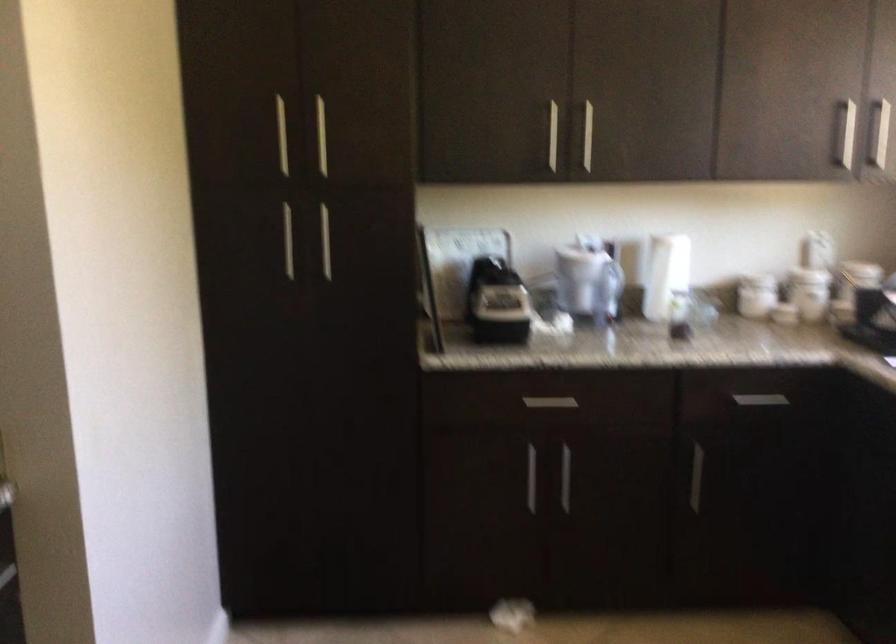
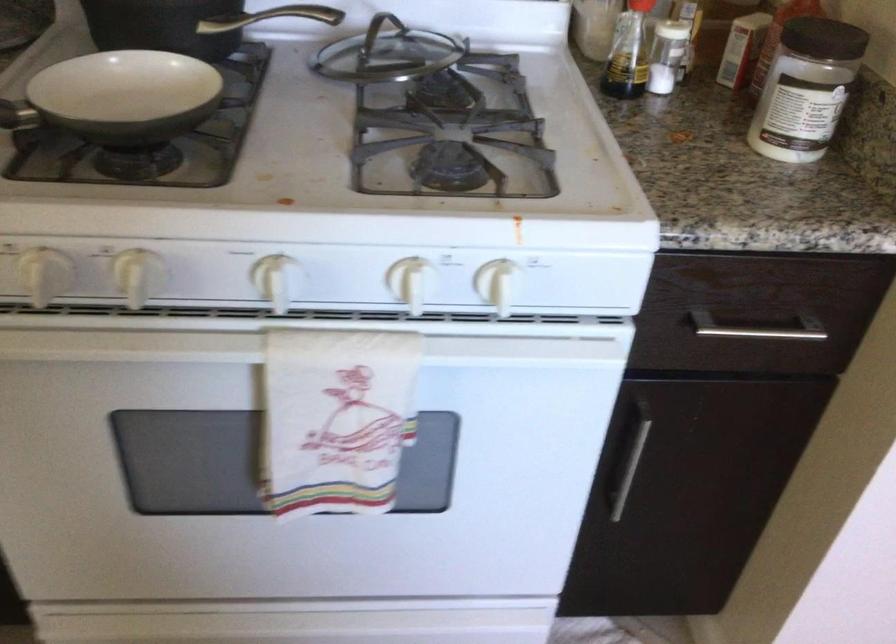
The images are taken continuously from a first-person perspective. In which direction is your viewpoint rotating?

The camera's rotation is toward left-down.